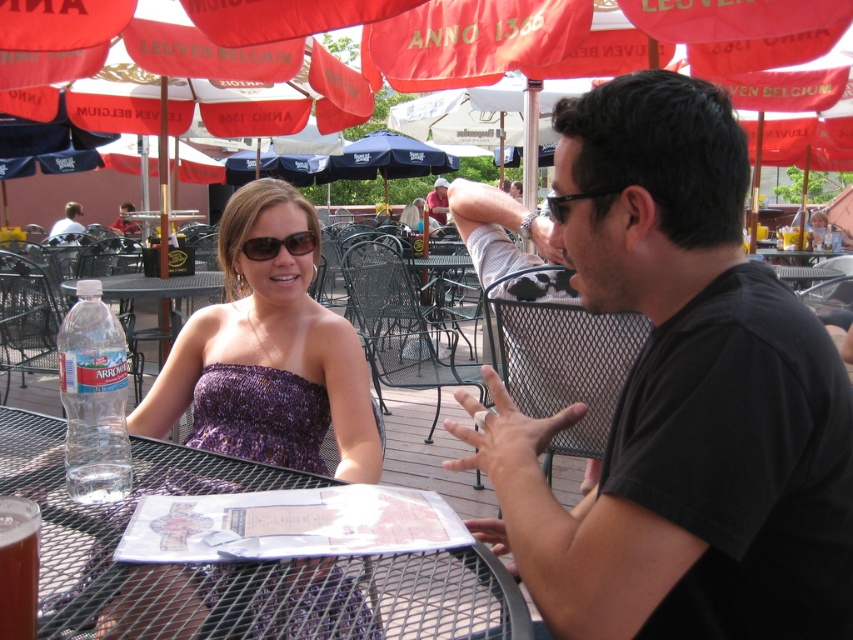
Question: Does black mesh table at center have a greater width compared to clear plastic bottle at table left?

Choices:
 (A) no
 (B) yes

Answer: (B)

Question: Which object is the farthest from the matte black shirt at upper left?

Choices:
 (A) matte black sunglasses at center
 (B) matte pink shirt at center

Answer: (A)

Question: Which object appears closest to the camera in this image?

Choices:
 (A) matte black sunglasses at center
 (B) black mesh table at center
 (C) brown glass at lower left

Answer: (C)

Question: Is clear plastic bottle at table left bigger than matte black shirt at upper left?

Choices:
 (A) no
 (B) yes

Answer: (A)

Question: Is black mesh table at center to the left of matte black sunglasses at center from the viewer's perspective?

Choices:
 (A) no
 (B) yes

Answer: (A)

Question: Which is farther from the matte pink shirt at center?

Choices:
 (A) matte black sunglasses at center
 (B) clear plastic bottle at table left

Answer: (B)